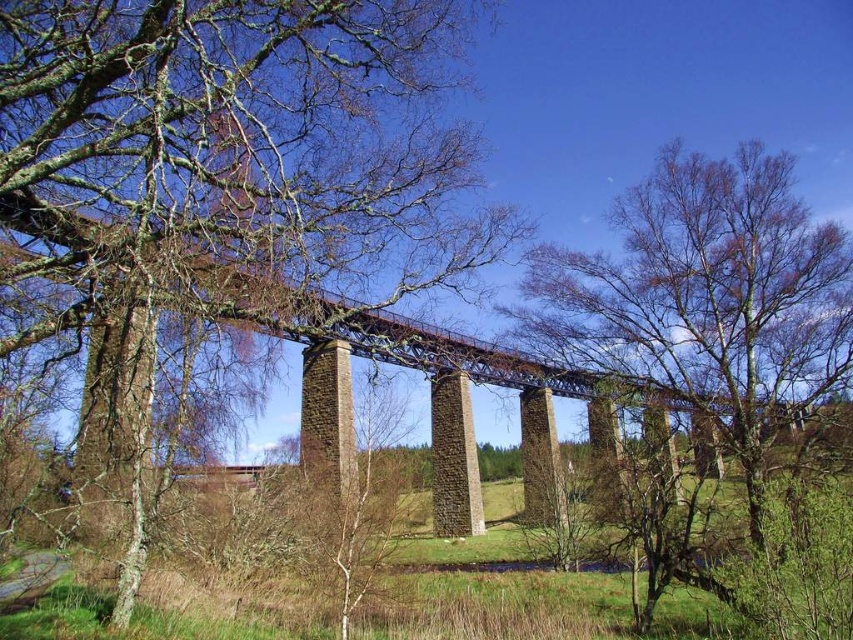
Does green leafy tree at center appear on the right side of brown stone bridge at center?

Yes, green leafy tree at center is to the right of brown stone bridge at center.

Does point (817, 385) come in front of point (177, 280)?

No, it is not.

The image size is (853, 640). Describe the element at coordinates (706, 300) in the screenshot. I see `green leafy tree at center` at that location.

Where is `green leafy tree at center`? green leafy tree at center is located at coordinates (706, 300).

Can you confirm if smooth bark tree at center is thinner than green leafy tree at center?

No.

Does point (138, 392) come in front of point (637, 333)?

Yes.

Find the location of `smooth bark tree at center`. smooth bark tree at center is located at coordinates (219, 172).

Can you confirm if smooth bark tree at center is wider than brown stone bridge at center?

No.

Based on the photo, who is positioned more to the right, smooth bark tree at center or brown stone bridge at center?

brown stone bridge at center is more to the right.

Which is behind, point (465, 243) or point (161, 248)?

The point (465, 243) is more distant.

The height and width of the screenshot is (640, 853). In order to click on smooth bark tree at center in this screenshot , I will do `click(219, 172)`.